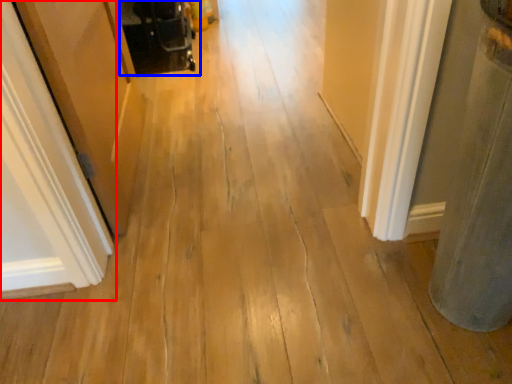
Question: Among these objects, which one is farthest to the camera, door (highlighted by a red box) or baby carriage (highlighted by a blue box)?

Choices:
 (A) door
 (B) baby carriage

Answer: (B)